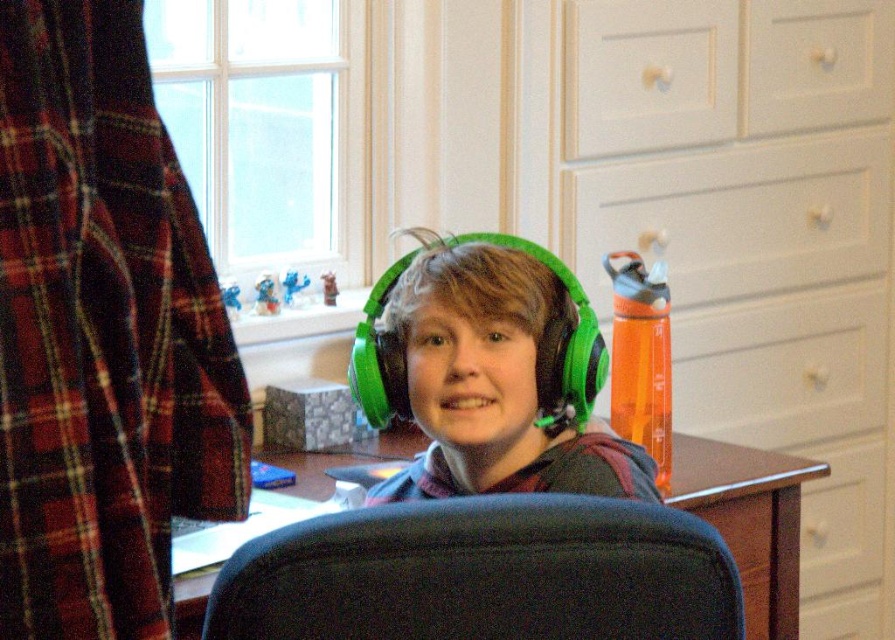
You are a delivery robot with a height of 1 meter. You are approaching the point marked at coordinates point (x=496, y=500). The distance between you and the point is 95.78 centimeters. Can you safely pass through this point without hitting your head on any objects?

The point (x=496, y=500) is 95.78 centimeters away from the viewer. Since the robot is 1 meter tall and the distance is sufficient, the robot can safely pass through the point without hitting its head as there is no mention of obstacles in the scene description.

You are organizing your home office and need to place a new item on the closest drawer to you. Which drawer should you choose between the white matte drawer at upper center and the white matte drawer at upper right?

The white matte drawer at upper center is closer to the viewer than the white matte drawer at upper right, so you should place the new item on the white matte drawer at upper center.

You are a delivery person who needs to place a small package on the desk between the black fabric swivel chair at center and the white matte drawer at upper center. Can you fit the package there?

The black fabric swivel chair at center is to the left of the white matte drawer at upper center, so there is space between them to place the small package.